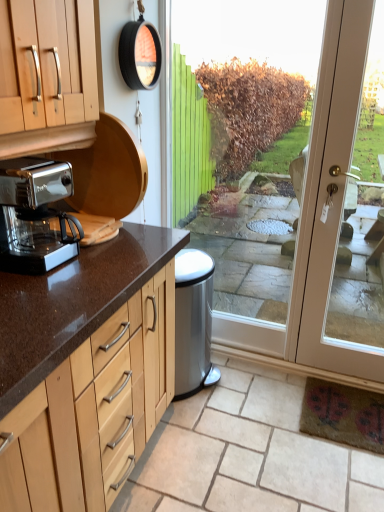
Identify the location of light brown wood at lower left. Image resolution: width=384 pixels, height=512 pixels. (248, 453).

This screenshot has width=384, height=512. Describe the element at coordinates (337, 205) in the screenshot. I see `white glossy door at right` at that location.

Where is `metallic glass coffee maker at left`? metallic glass coffee maker at left is located at coordinates (36, 215).

Can you confirm if metallic glass coffee maker at left is shorter than light brown wood at lower left?

No, metallic glass coffee maker at left is not shorter than light brown wood at lower left.

Consider the image. From a real-world perspective, is metallic glass coffee maker at left positioned under light brown wood at lower left based on gravity?

No, from a real-world perspective, metallic glass coffee maker at left is not beneath light brown wood at lower left.

Which is correct: metallic glass coffee maker at left is inside light brown wood at lower left, or outside of it?

metallic glass coffee maker at left exists outside the volume of light brown wood at lower left.

Is the depth of metallic glass coffee maker at left greater than that of transparent glass door at center?

No, it is not.

Based on their sizes in the image, would you say metallic glass coffee maker at left is bigger or smaller than transparent glass door at center?

Clearly, metallic glass coffee maker at left is smaller in size than transparent glass door at center.

Between point (38, 262) and point (330, 210), which one is positioned in front?

The point (38, 262) is in front.

Is metallic glass coffee maker at left not close to white glossy door at right?

Yes.

From a real-world perspective, between metallic glass coffee maker at left and white glossy door at right, who is vertically lower?

white glossy door at right, from a real-world perspective.

Considering the positions of objects transparent glass door at center and metallic glass coffee maker at left in the image provided, who is more to the right, transparent glass door at center or metallic glass coffee maker at left?

transparent glass door at center is more to the right.

How many degrees apart are the facing directions of transparent glass door at center and metallic glass coffee maker at left?

There is a 90.1-degree angle between the facing directions of transparent glass door at center and metallic glass coffee maker at left.

Are transparent glass door at center and metallic glass coffee maker at left located far from each other?

Indeed, transparent glass door at center is not near metallic glass coffee maker at left.

Identify the location of coffee maker located above the white glossy door at right (from a real-world perspective). The height and width of the screenshot is (512, 384). (36, 215).

Does point (318, 282) come closer to viewer compared to point (37, 234)?

No, it is not.

Between white glossy door at right and metallic glass coffee maker at left, which one has larger size?

white glossy door at right.

Between light brown wood at lower left and white glossy door at right, which one appears on the right side from the viewer's perspective?

Positioned to the right is white glossy door at right.

Based on their sizes in the image, would you say light brown wood at lower left is bigger or smaller than white glossy door at right?

Considering their sizes, light brown wood at lower left takes up less space than white glossy door at right.

Could you tell me if light brown wood at lower left is turned towards white glossy door at right?

No, light brown wood at lower left is not turned towards white glossy door at right.

Does point (316, 21) come closer to viewer compared to point (188, 477)?

That is False.

Is there a large distance between transparent glass door at center and light brown wood at lower left?

Yes, transparent glass door at center and light brown wood at lower left are located far from each other.

From the image's perspective, is transparent glass door at center under light brown wood at lower left?

Incorrect, from the image's perspective, transparent glass door at center is higher than light brown wood at lower left.

Locate an element on the screen. tile on the right of the metallic glass coffee maker at left is located at coordinates (248, 453).

In the image, there is a transparent glass door at center. Where is `coffee maker below it (from the image's perspective)`? coffee maker below it (from the image's perspective) is located at coordinates (36, 215).

From the image, which object appears to be nearer to white glossy door at right, transparent glass door at center or light brown wood at lower left?

light brown wood at lower left.

From the image, which object appears to be farther from transparent glass door at center, white glossy door at right or light brown wood at lower left?

Based on the image, light brown wood at lower left appears to be further to transparent glass door at center.

Looking at this image, from the image, which object appears to be farther from transparent glass door at center, light brown wood at lower left or white glossy door at right?

light brown wood at lower left is further to transparent glass door at center.

Which object lies further to the anchor point light brown wood at lower left, metallic glass coffee maker at left or white glossy door at right?

Among the two, metallic glass coffee maker at left is located further to light brown wood at lower left.

Considering their positions, is metallic glass coffee maker at left positioned closer to light brown wood at lower left than transparent glass door at center?

metallic glass coffee maker at left lies closer to light brown wood at lower left than the other object.

From the picture: From the image, which object appears to be farther from light brown wood at lower left, transparent glass door at center or metallic glass coffee maker at left?

The object further to light brown wood at lower left is transparent glass door at center.

In the scene shown: From the image, which object appears to be nearer to white glossy door at right, metallic glass coffee maker at left or transparent glass door at center?

The object closer to white glossy door at right is metallic glass coffee maker at left.

Considering their positions, is white glossy door at right positioned closer to transparent glass door at center than metallic glass coffee maker at left?

white glossy door at right lies closer to transparent glass door at center than the other object.

Where is `tile between metallic glass coffee maker at left and white glossy door at right`? This screenshot has width=384, height=512. tile between metallic glass coffee maker at left and white glossy door at right is located at coordinates (248, 453).

Identify the location of coffee maker that lies between transparent glass door at center and light brown wood at lower left from top to bottom. This screenshot has width=384, height=512. (36, 215).

I want to click on door between transparent glass door at center and light brown wood at lower left from top to bottom, so click(337, 205).

Find the location of a particular element. screen door between metallic glass coffee maker at left and white glossy door at right from left to right is located at coordinates (300, 176).